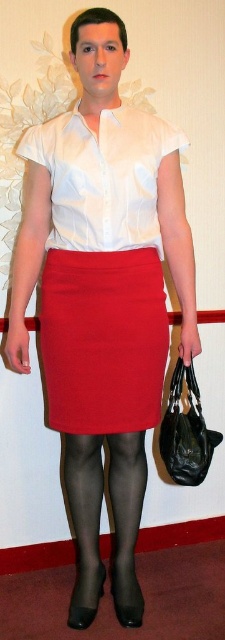
Does point (65, 276) come farther from viewer compared to point (139, 189)?

Yes.

This screenshot has width=225, height=640. I want to click on matte red skirt at center, so click(103, 340).

Who is more forward, (81,288) or (137,529)?

Point (81,288)

Does point (119, 310) lie in front of point (96, 557)?

Yes, point (119, 310) is in front of point (96, 557).

The width and height of the screenshot is (225, 640). I want to click on matte red skirt at center, so click(103, 340).

Is point (78, 216) positioned after point (119, 540)?

No, (78, 216) is in front of (119, 540).

You are a GUI agent. You are given a task and a screenshot of the screen. Output one action in this format:
    pyautogui.click(x=<x>, y=<y>)
    Task: Click on the white satin blouse at upper center
    
    Given the screenshot: What is the action you would take?
    pyautogui.click(x=103, y=177)